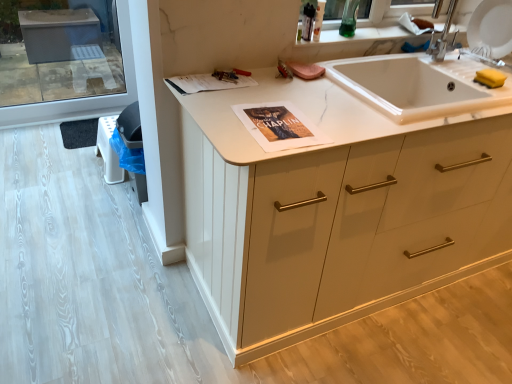
Question: From a real-world perspective, is white marble sink at center beneath white matte cabinet at center?

Choices:
 (A) yes
 (B) no

Answer: (B)

Question: Is white marble sink at center placed right next to white matte cabinet at center?

Choices:
 (A) yes
 (B) no

Answer: (B)

Question: Is white marble sink at center taller than white matte cabinet at center?

Choices:
 (A) yes
 (B) no

Answer: (B)

Question: Does white marble sink at center come in front of white matte cabinet at center?

Choices:
 (A) yes
 (B) no

Answer: (B)

Question: From a real-world perspective, does white marble sink at center stand above white matte cabinet at center?

Choices:
 (A) no
 (B) yes

Answer: (B)

Question: Can you confirm if white marble sink at center is thinner than white matte cabinet at center?

Choices:
 (A) yes
 (B) no

Answer: (A)

Question: From a real-world perspective, is white matte cabinet at center located beneath white marble sink at center?

Choices:
 (A) no
 (B) yes

Answer: (B)

Question: Would you say white matte cabinet at center is outside white marble sink at center?

Choices:
 (A) no
 (B) yes

Answer: (B)

Question: Are white matte cabinet at center and white marble sink at center located far from each other?

Choices:
 (A) yes
 (B) no

Answer: (B)

Question: Is white matte cabinet at center shorter than white marble sink at center?

Choices:
 (A) yes
 (B) no

Answer: (B)

Question: Considering the relative sizes of white matte cabinet at center and white marble sink at center in the image provided, is white matte cabinet at center smaller than white marble sink at center?

Choices:
 (A) no
 (B) yes

Answer: (A)

Question: Considering the relative sizes of white matte cabinet at center and white marble sink at center in the image provided, is white matte cabinet at center wider than white marble sink at center?

Choices:
 (A) yes
 (B) no

Answer: (A)

Question: Is white matte cabinet at center oriented away from matte paper magazine at upper center?

Choices:
 (A) no
 (B) yes

Answer: (B)